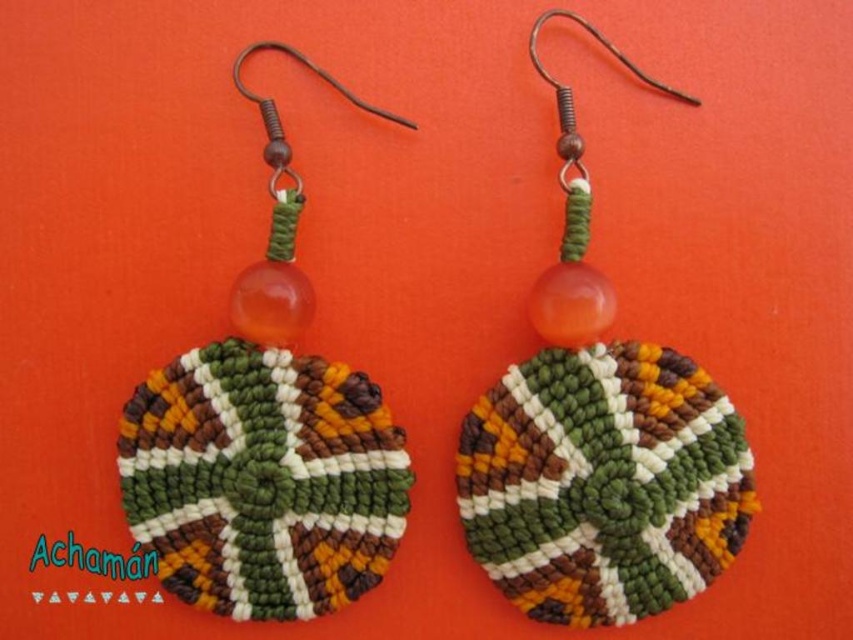
Does multicolored woven disc at center have a greater width compared to matte woven disc at center?

Yes, multicolored woven disc at center is wider than matte woven disc at center.

Is multicolored woven disc at center above matte woven disc at center?

Correct, multicolored woven disc at center is located above matte woven disc at center.

In order to click on multicolored woven disc at center in this screenshot , I will do `click(599, 444)`.